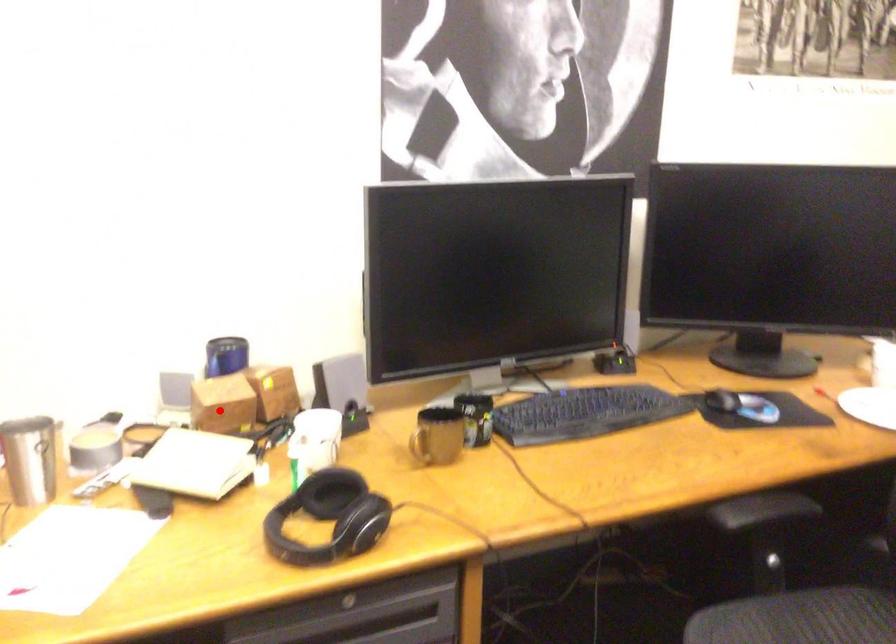
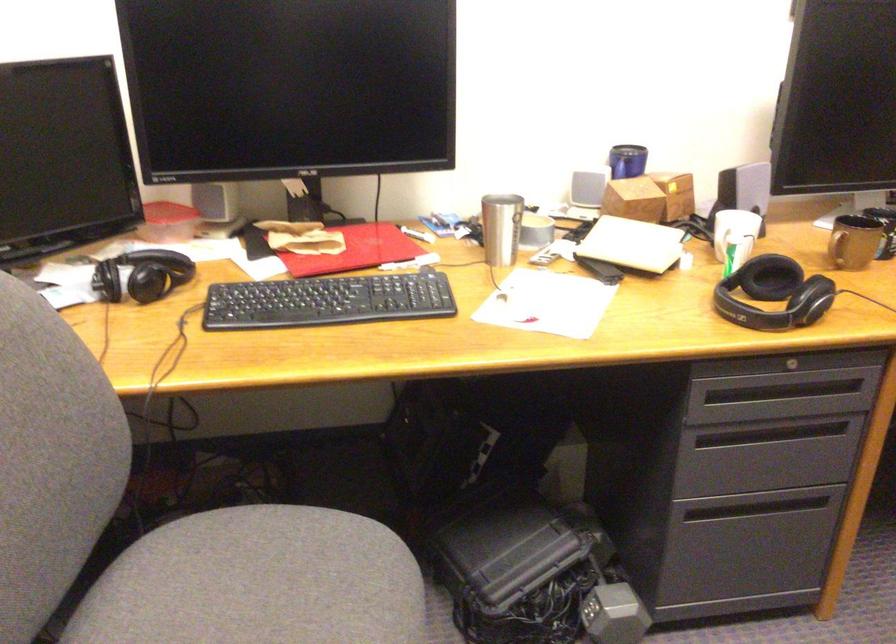
Question: I am providing you with two images of the same scene from different viewpoints. Image1 has a red point marked. In image2, the corresponding 3D location appears at what relative position? Reply with the corresponding letter.

Choices:
 (A) Closer
 (B) Farther

Answer: (B)